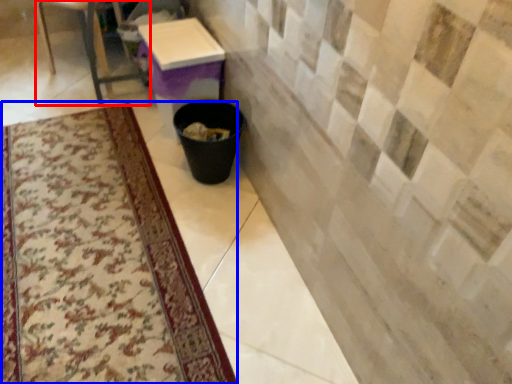
Question: Which point is closer to the camera, furniture (highlighted by a red box) or mat (highlighted by a blue box)?

Choices:
 (A) furniture
 (B) mat

Answer: (B)